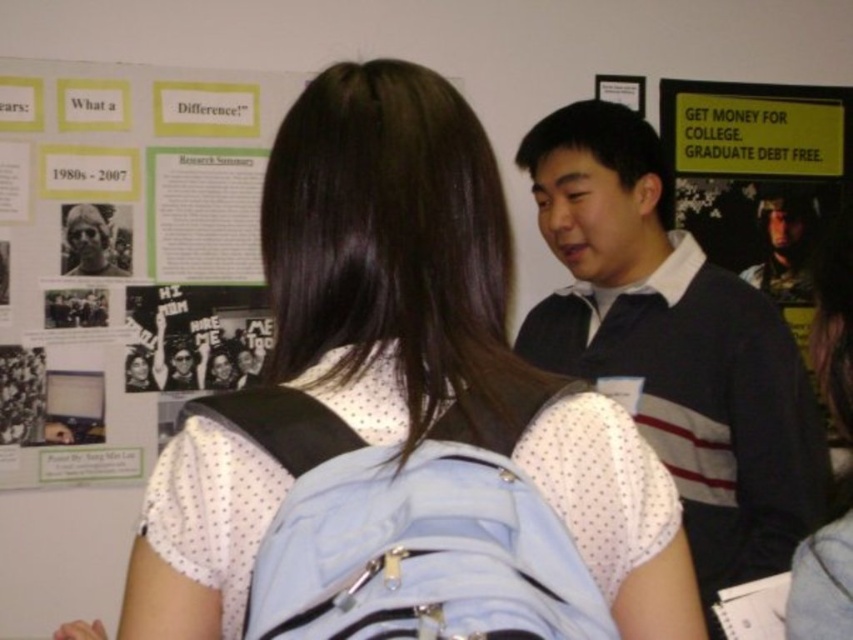
Where is the light blue fabric backpack at center located in the image?

The light blue fabric backpack at center is located at point (403, 534) in the image.